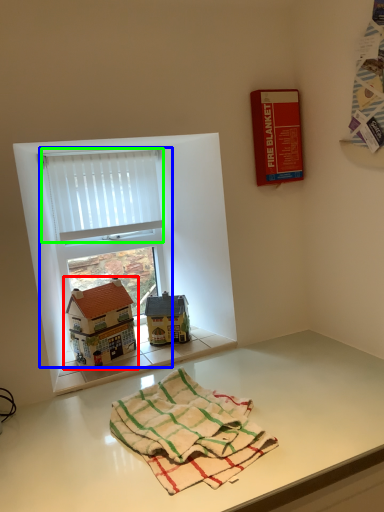
Question: Based on their relative distances, which object is farther from toy (highlighted by a red box)? Choose from window (highlighted by a blue box) and curtain (highlighted by a green box).

Choices:
 (A) window
 (B) curtain

Answer: (B)